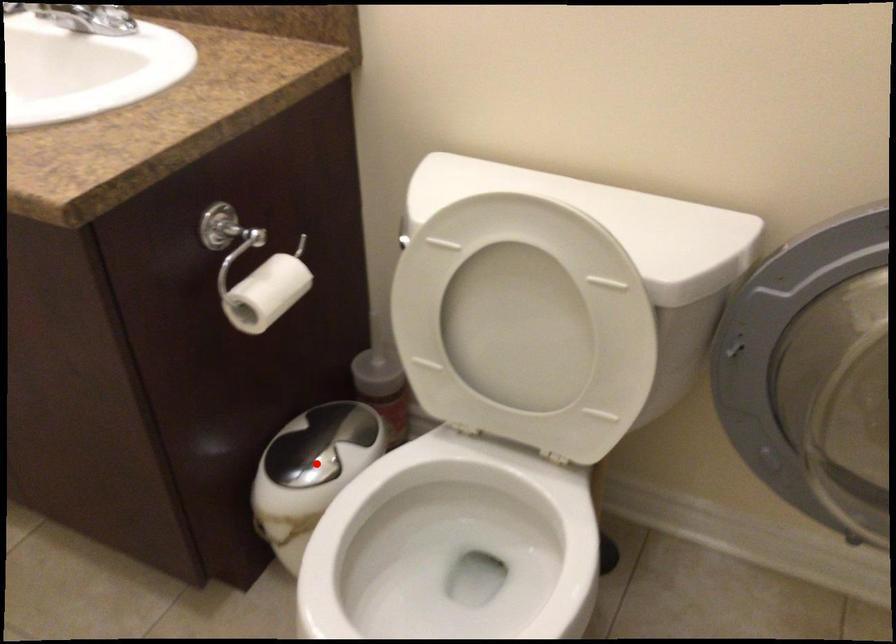
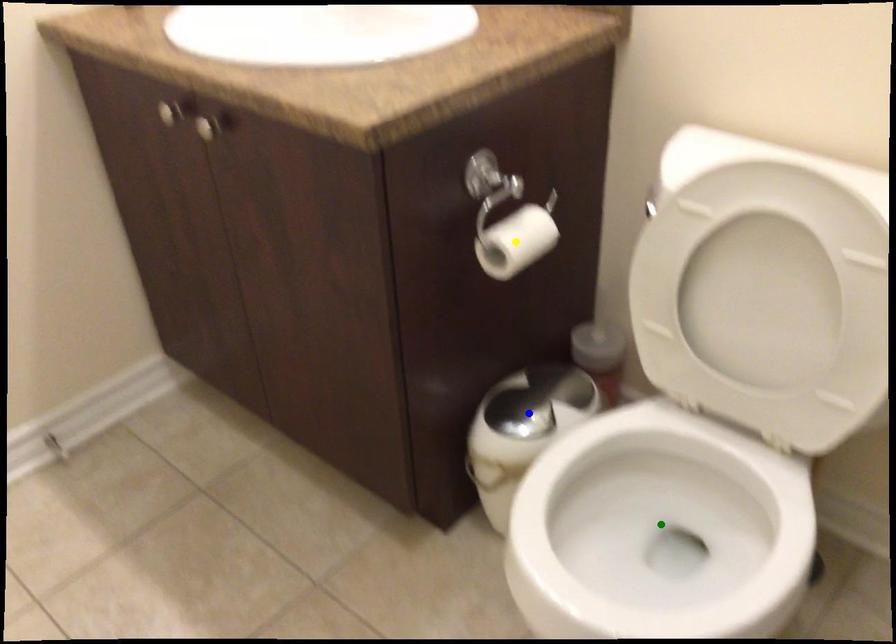
Question: I am providing you with two images of the same scene from different viewpoints. A red point is marked on the first image. You are given multiple points on the second image. Which mark in image 2 goes with the point in image 1?

Choices:
 (A) yellow point
 (B) blue point
 (C) green point

Answer: (B)